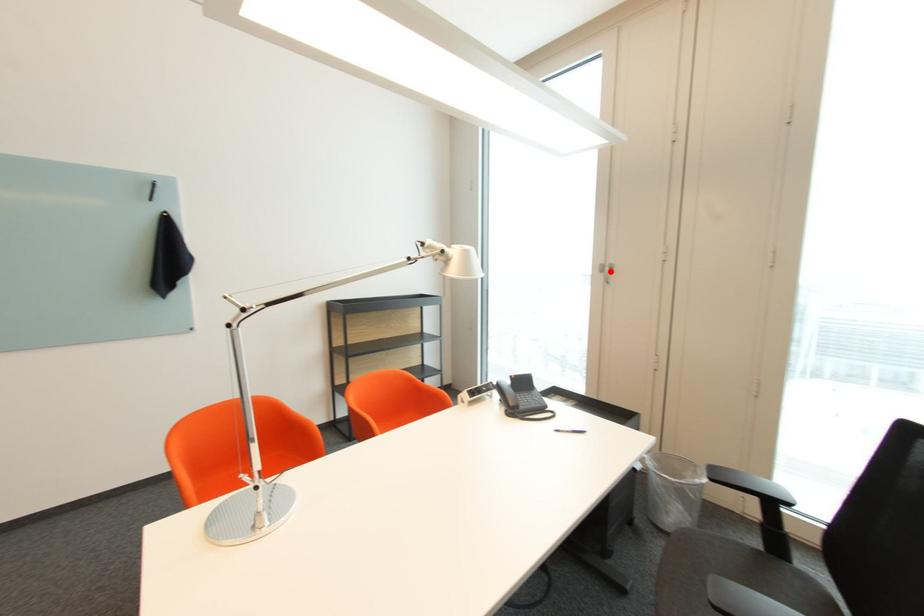
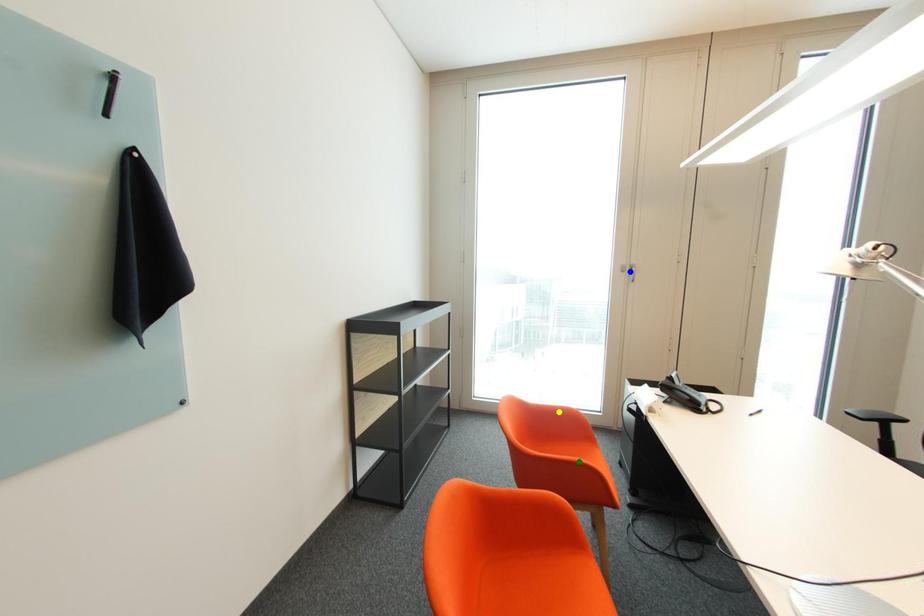
Question: I am providing you with two images of the same scene from different viewpoints. A red point is marked on the first image. You are given multiple points on the second image. Which spot in image 2 lines up with the point in image 1?

Choices:
 (A) blue point
 (B) yellow point
 (C) green point

Answer: (A)